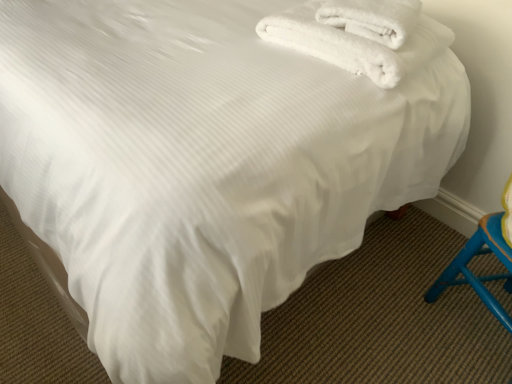
Question: Is white fluffy towel at upper right, which is the second towel from left to right, positioned behind white fluffy towels at upper right, positioned as the second towel in right-to-left order?

Choices:
 (A) yes
 (B) no

Answer: (A)

Question: Considering the relative positions of white fluffy towel at upper right, which is the second towel from left to right, and white fluffy towels at upper right, the 1th towel in the left-to-right sequence, in the image provided, is white fluffy towel at upper right, which is the second towel from left to right, in front of white fluffy towels at upper right, the 1th towel in the left-to-right sequence,?

Choices:
 (A) no
 (B) yes

Answer: (A)

Question: Can you confirm if white fluffy towel at upper right, which is the first towel in right-to-left order, is positioned to the right of white fluffy towels at upper right, positioned as the second towel in right-to-left order?

Choices:
 (A) yes
 (B) no

Answer: (A)

Question: From the image's perspective, is white fluffy towel at upper right, which is the second towel from left to right, under white fluffy towels at upper right, the 1th towel in the left-to-right sequence?

Choices:
 (A) yes
 (B) no

Answer: (B)

Question: Is white fluffy towel at upper right, which is the first towel in right-to-left order, wider than white fluffy towels at upper right, positioned as the second towel in right-to-left order?

Choices:
 (A) yes
 (B) no

Answer: (B)

Question: Is white fluffy towel at upper right, which is the second towel from left to right, to the left of white fluffy towels at upper right, positioned as the second towel in right-to-left order, from the viewer's perspective?

Choices:
 (A) no
 (B) yes

Answer: (A)

Question: Is white fluffy towel at upper right, which is the first towel in right-to-left order, located within white fluffy towels at upper right, the 1th towel in the left-to-right sequence?

Choices:
 (A) no
 (B) yes

Answer: (A)

Question: Is the depth of white fluffy towels at upper right, positioned as the second towel in right-to-left order, less than that of white fluffy towel at upper right, which is the first towel in right-to-left order?

Choices:
 (A) no
 (B) yes

Answer: (B)

Question: Is white fluffy towels at upper right, the 1th towel in the left-to-right sequence, bigger than white fluffy towel at upper right, which is the second towel from left to right?

Choices:
 (A) yes
 (B) no

Answer: (A)

Question: Considering the relative sizes of white fluffy towels at upper right, the 1th towel in the left-to-right sequence, and white fluffy towel at upper right, which is the first towel in right-to-left order, in the image provided, is white fluffy towels at upper right, the 1th towel in the left-to-right sequence, wider than white fluffy towel at upper right, which is the first towel in right-to-left order,?

Choices:
 (A) no
 (B) yes

Answer: (B)

Question: Is white fluffy towels at upper right, positioned as the second towel in right-to-left order, located outside white fluffy towel at upper right, which is the first towel in right-to-left order?

Choices:
 (A) no
 (B) yes

Answer: (B)

Question: Is white fluffy towel at upper right, which is the second towel from left to right, bigger or smaller than white fluffy towels at upper right, positioned as the second towel in right-to-left order?

Choices:
 (A) small
 (B) big

Answer: (A)